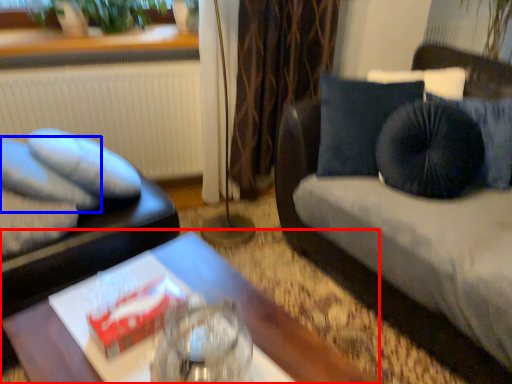
Question: Which object is closer to the camera taking this photo, table (highlighted by a red box) or pillow (highlighted by a blue box)?

Choices:
 (A) table
 (B) pillow

Answer: (A)